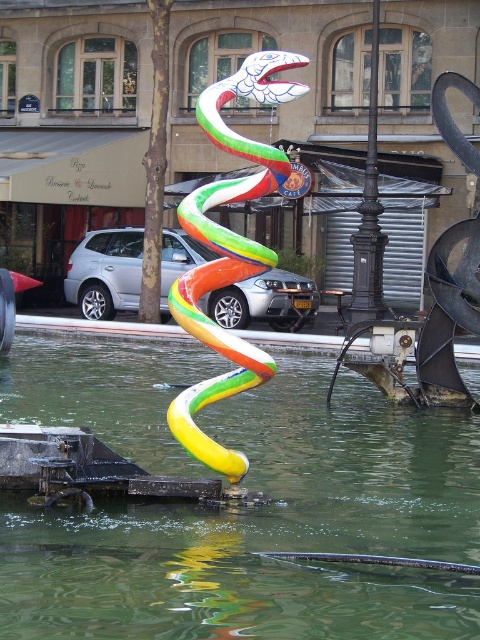
Question: Which of these objects is positioned farthest from the black wrought iron pole at center?

Choices:
 (A) multicolored glossy snake at center
 (B) translucent green water at center

Answer: (A)

Question: Which object is farther from the camera taking this photo?

Choices:
 (A) silver metallic suv at center
 (B) black wrought iron pole at center
 (C) multicolored glossy snake at center

Answer: (A)

Question: Which object is closer to the camera taking this photo?

Choices:
 (A) translucent green water at center
 (B) multicolored glossy snake at center

Answer: (A)

Question: Does silver metallic suv at center appear over black wrought iron pole at center?

Choices:
 (A) no
 (B) yes

Answer: (A)

Question: Is the position of translucent green water at center more distant than that of black wrought iron pole at center?

Choices:
 (A) no
 (B) yes

Answer: (A)

Question: Does multicolored glossy snake at center appear over silver metallic suv at center?

Choices:
 (A) no
 (B) yes

Answer: (A)